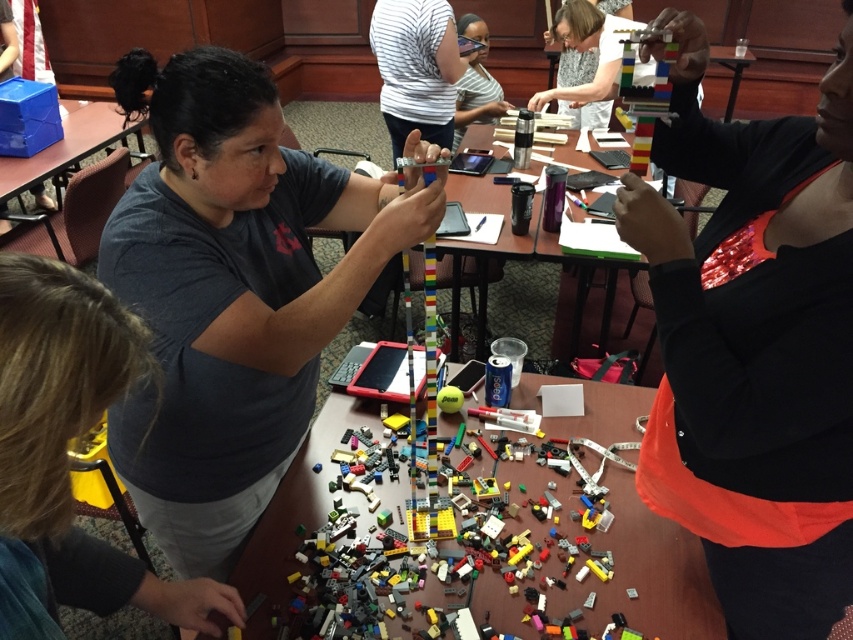
Question: Which is farther from the multicolored plastic lego pieces at center?

Choices:
 (A) matte gray shirt at center
 (B) matte gray shirt at upper center

Answer: (B)

Question: Does shiny metallic bracelet at upper right appear over matte gray shirt at upper center?

Choices:
 (A) yes
 (B) no

Answer: (A)

Question: Is the position of shiny metallic bracelet at upper right less distant than that of blue plastic table at upper left?

Choices:
 (A) yes
 (B) no

Answer: (A)

Question: Which point is farther from the camera taking this photo?

Choices:
 (A) (80, 116)
 (B) (265, 202)
 (C) (502, 232)
 (D) (755, 136)

Answer: (A)

Question: Can you confirm if translucent purple cup at center is positioned to the right of blue plastic table at upper left?

Choices:
 (A) yes
 (B) no

Answer: (A)

Question: Which object appears farthest from the camera in this image?

Choices:
 (A) multicolored plastic lego pieces at center
 (B) blue plastic table at upper left
 (C) matte gray shirt at center
 (D) translucent purple cup at center

Answer: (B)